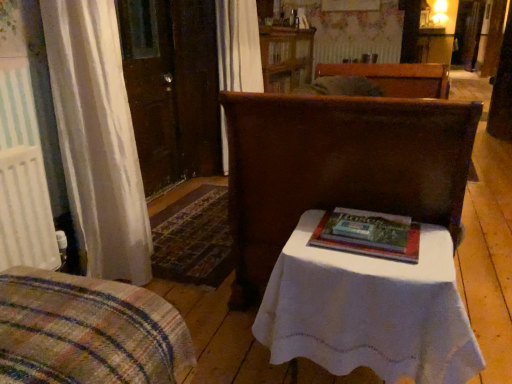
Find the location of `free space above white cloth-covered table at center (from a real-world perspective)`. free space above white cloth-covered table at center (from a real-world perspective) is located at coordinates (364, 244).